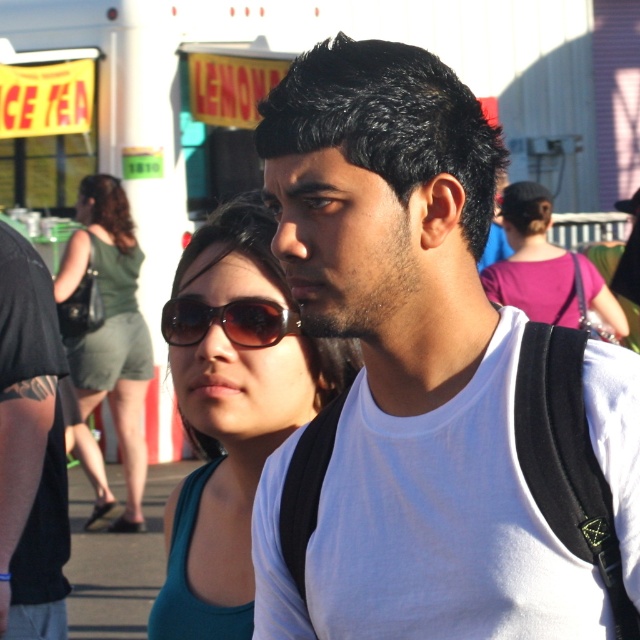
You are a photographer trying to capture both the white matte tank top at center and the black backpack on the man. Can you fit both in your camera frame if your camera has a maximum width of 3 meters?

The distance between the white matte tank top at center and the black backpack on the man is 3.30 meters, which exceeds the camera frame width of 3 meters. Therefore, both cannot be captured in a single frame.

You are a photographer trying to capture the green fabric dress at left and the brown reflective sunglasses at center in a single frame. Given that the dress is larger, which object should you focus on to ensure both are in the frame without cropping?

Since the green fabric dress at left is larger than the brown reflective sunglasses at center, you should focus on the green fabric dress at left to ensure both objects fit within the frame without cropping.

You are a photographer trying to capture a clear shot of both the white matte tank top at center and the purple fabric shirt at upper right in the crowd. Which one should you focus on first to ensure it appears larger in the photo?

The purple fabric shirt at upper right should be focused on first because it is larger in size compared to the white matte tank top at center, ensuring it appears bigger in the photo.